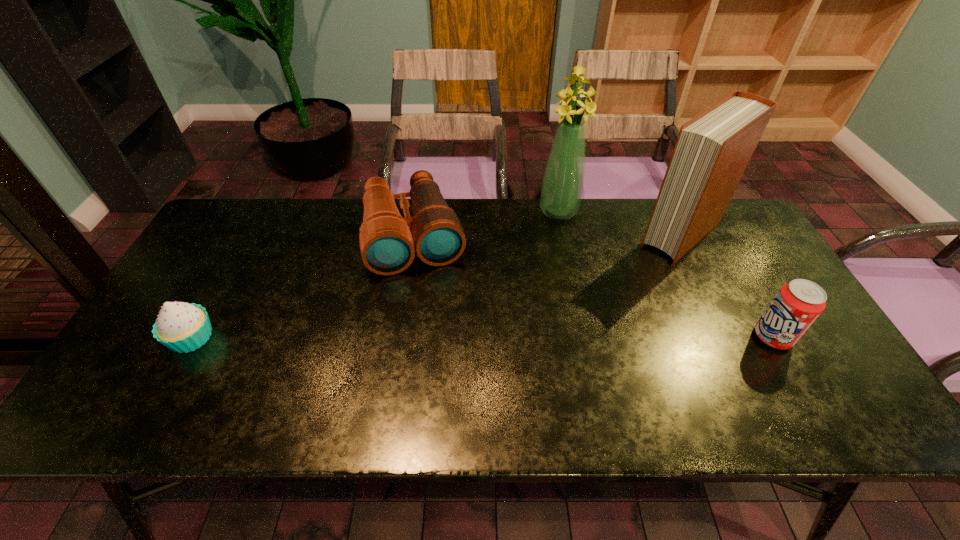
Image resolution: width=960 pixels, height=540 pixels. I want to click on free space located on the front-facing side of the bouquet, so click(x=554, y=263).

Where is `vacant point located 0.330m on the front-facing side of the bouquet`? The height and width of the screenshot is (540, 960). vacant point located 0.330m on the front-facing side of the bouquet is located at coordinates (551, 301).

The width and height of the screenshot is (960, 540). What are the coordinates of `vacant space located 0.200m on the front-facing side of the bouquet` in the screenshot? It's located at (554, 267).

Find the location of a particular element. The height and width of the screenshot is (540, 960). vacant position located 0.160m on the open cover of the hardback book is located at coordinates (625, 282).

Image resolution: width=960 pixels, height=540 pixels. In order to click on vacant point located on the open cover of the hardback book in this screenshot , I will do `click(612, 293)`.

Where is `vacant space located on the open cover of the hardback book`? vacant space located on the open cover of the hardback book is located at coordinates (573, 327).

I want to click on vacant space located 0.150m through the lenses of the second object from left to right, so click(433, 319).

Locate an element on the screen. The width and height of the screenshot is (960, 540). free space located through the lenses of the second object from left to right is located at coordinates (446, 374).

The image size is (960, 540). What are the coordinates of `free space located 0.080m through the lenses of the second object from left to right` in the screenshot? It's located at (428, 299).

Where is `bouquet located at the far edge`? bouquet located at the far edge is located at coordinates (562, 187).